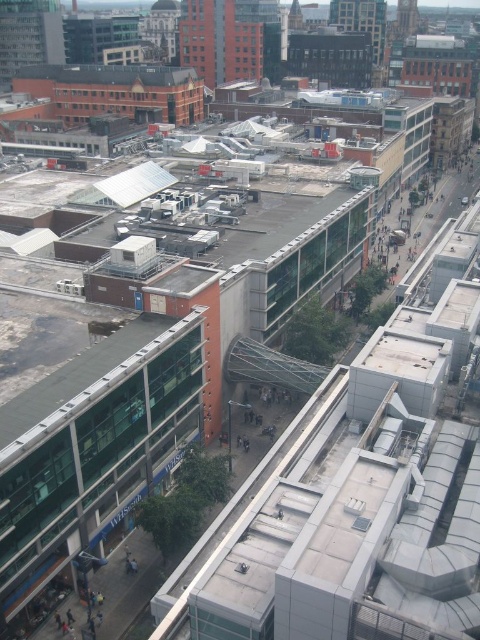
You are a city planner reviewing this urban layout. You need to determine if the green glass roof at center can provide shade to the brown corrugated metal roof at upper center during midday. Based on their heights, what is your conclusion?

The green glass roof at center is shorter than the brown corrugated metal roof at upper center, so it cannot provide shade to the brown corrugated metal roof at upper center because it is not tall enough.

You are standing at the blue WHSmith building and want to reach the point marked as point (38, 81). To get there, you need to walk towards the point marked as point (75, 403). Is the point you want to reach behind or in front of the point you are walking towards?

The point (38, 81) is behind the point (75, 403) because the point (75, 403) is in front of point (38, 81) according to the spatial description.